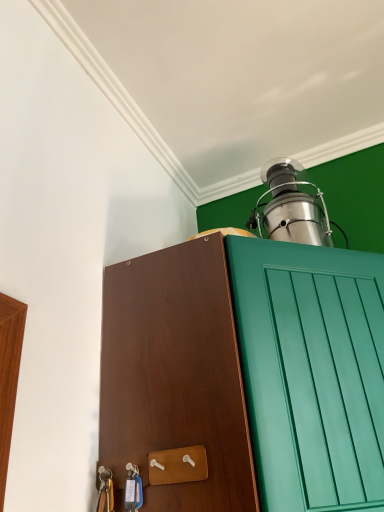
Question: In the image, is stainless steel oil lamp at upper right on the left side or the right side of brown wood cabinet at center?

Choices:
 (A) left
 (B) right

Answer: (B)

Question: From the image's perspective, is stainless steel oil lamp at upper right located above or below brown wood cabinet at center?

Choices:
 (A) above
 (B) below

Answer: (A)

Question: In terms of width, does stainless steel oil lamp at upper right look wider or thinner when compared to brown wood cabinet at center?

Choices:
 (A) wide
 (B) thin

Answer: (B)

Question: Is brown wood cabinet at center taller or shorter than stainless steel oil lamp at upper right?

Choices:
 (A) tall
 (B) short

Answer: (A)

Question: From the image's perspective, relative to stainless steel oil lamp at upper right, is brown wood cabinet at center above or below?

Choices:
 (A) above
 (B) below

Answer: (B)

Question: In the image, is brown wood cabinet at center on the left side or the right side of stainless steel oil lamp at upper right?

Choices:
 (A) right
 (B) left

Answer: (B)

Question: Is brown wood cabinet at center wider or thinner than stainless steel oil lamp at upper right?

Choices:
 (A) thin
 (B) wide

Answer: (B)